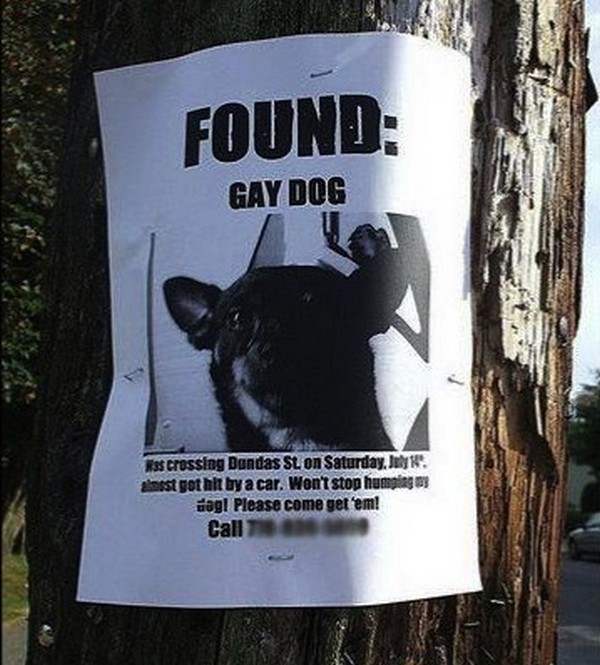
In order to click on poster in this screenshot , I will do `click(301, 575)`.